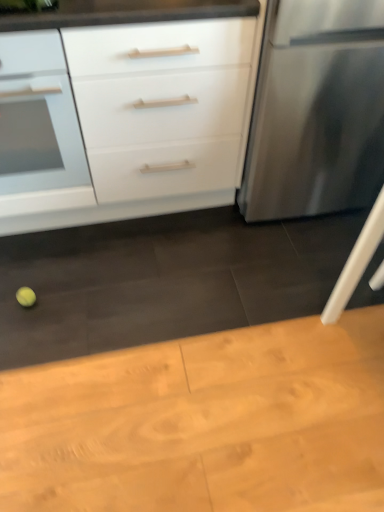
Question: Should I look upward or downward to see yellow matte tennis ball at lower left?

Choices:
 (A) down
 (B) up

Answer: (A)

Question: Should I look upward or downward to see wooden table at lower center?

Choices:
 (A) down
 (B) up

Answer: (A)

Question: Is white matte cabinet at center located outside stainless steel refrigerator at right?

Choices:
 (A) yes
 (B) no

Answer: (A)

Question: Considering the relative positions of white matte cabinet at center and stainless steel refrigerator at right in the image provided, is white matte cabinet at center behind stainless steel refrigerator at right?

Choices:
 (A) no
 (B) yes

Answer: (A)

Question: Is white matte cabinet at center wider than stainless steel refrigerator at right?

Choices:
 (A) yes
 (B) no

Answer: (B)

Question: Considering the relative sizes of white matte cabinet at center and stainless steel refrigerator at right in the image provided, is white matte cabinet at center smaller than stainless steel refrigerator at right?

Choices:
 (A) yes
 (B) no

Answer: (B)

Question: Is the surface of white matte cabinet at center in direct contact with stainless steel refrigerator at right?

Choices:
 (A) no
 (B) yes

Answer: (A)

Question: Is white matte cabinet at center not near stainless steel refrigerator at right?

Choices:
 (A) no
 (B) yes

Answer: (A)

Question: Considering the relative sizes of white matte drawer at left, which is the second drawer from front to back, and white matte drawer at upper left, which is the 2th drawer in back-to-front order, in the image provided, is white matte drawer at left, which is the second drawer from front to back, bigger than white matte drawer at upper left, which is the 2th drawer in back-to-front order,?

Choices:
 (A) yes
 (B) no

Answer: (A)

Question: Is white matte drawer at left, which is the second drawer from front to back, oriented away from white matte drawer at upper left, the 1th drawer in the front-to-back sequence?

Choices:
 (A) yes
 (B) no

Answer: (B)

Question: Does white matte drawer at left, which ranks as the first drawer in back-to-front order, have a greater height compared to white matte drawer at upper left, the 1th drawer in the front-to-back sequence?

Choices:
 (A) no
 (B) yes

Answer: (B)

Question: Can you confirm if white matte drawer at left, which ranks as the first drawer in back-to-front order, is thinner than white matte drawer at upper left, which is the 2th drawer in back-to-front order?

Choices:
 (A) yes
 (B) no

Answer: (B)

Question: Would you say white matte drawer at left, which is the second drawer from front to back, is outside white matte drawer at upper left, which is the 2th drawer in back-to-front order?

Choices:
 (A) no
 (B) yes

Answer: (B)

Question: From a real-world perspective, is white matte drawer at left, which is the second drawer from front to back, under white matte drawer at upper left, which is the 2th drawer in back-to-front order?

Choices:
 (A) yes
 (B) no

Answer: (A)

Question: Would you consider yellow matte tennis ball at lower left to be distant from white matte drawer at upper left, the 1th drawer in the front-to-back sequence?

Choices:
 (A) yes
 (B) no

Answer: (B)